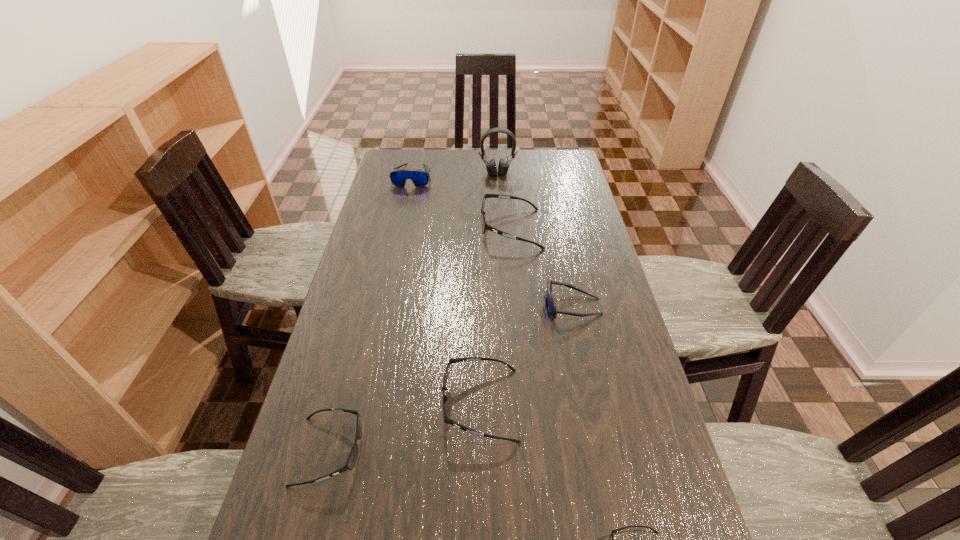
The image size is (960, 540). In order to click on free region located 0.170m on the front-facing side of the farthest gray sunglasses in this screenshot , I will do `click(433, 229)`.

You are a GUI agent. You are given a task and a screenshot of the screen. Output one action in this format:
    pyautogui.click(x=<x>, y=<y>)
    Task: Click on the free region located on the front-facing side of the farthest gray sunglasses
    The height and width of the screenshot is (540, 960).
    Given the screenshot: What is the action you would take?
    pyautogui.click(x=414, y=229)

I want to click on free space located 0.240m on the front-facing side of the farthest gray sunglasses, so click(414, 229).

Find the location of `vacant area situated 0.290m on the front-facing side of the bigger blue sunglasses`. vacant area situated 0.290m on the front-facing side of the bigger blue sunglasses is located at coordinates (400, 234).

Locate an element on the screen. vacant space positioned 0.090m on the front-facing side of the third smallest gray sunglasses is located at coordinates [x=406, y=404].

Where is `vacant region located on the front-facing side of the third smallest gray sunglasses`? This screenshot has height=540, width=960. vacant region located on the front-facing side of the third smallest gray sunglasses is located at coordinates point(360,404).

At what (x,y) coordinates should I click in order to perform the action: click on vacant region located on the front-facing side of the third smallest gray sunglasses. Please return your answer as a coordinate pair (x, y). Image resolution: width=960 pixels, height=540 pixels. Looking at the image, I should click on (364, 404).

Where is `free location located 0.230m on the front-facing side of the fourth farthest object`? free location located 0.230m on the front-facing side of the fourth farthest object is located at coordinates (466, 306).

You are a GUI agent. You are given a task and a screenshot of the screen. Output one action in this format:
    pyautogui.click(x=<x>, y=<y>)
    Task: Click on the vacant area located 0.240m on the front-facing side of the fourth farthest object
    This screenshot has height=540, width=960.
    Given the screenshot: What is the action you would take?
    pyautogui.click(x=462, y=306)

Where is `free region located 0.390m on the front-facing side of the fourth farthest object`? This screenshot has width=960, height=540. free region located 0.390m on the front-facing side of the fourth farthest object is located at coordinates (411, 306).